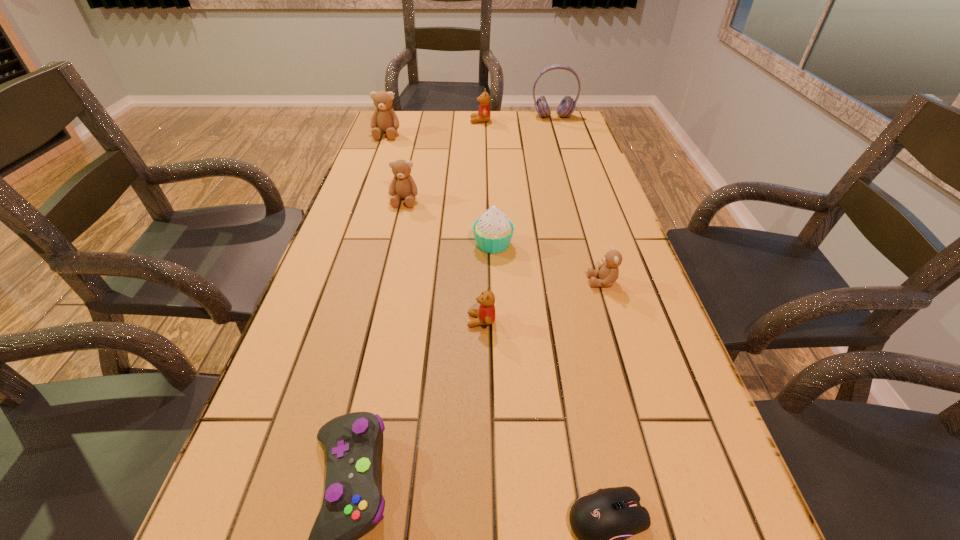
In order to click on the tallest object in this screenshot , I will do `click(567, 105)`.

Identify the location of the farthest brown teddy bear. This screenshot has width=960, height=540. (384, 119).

This screenshot has height=540, width=960. I want to click on the eighth shortest object, so click(384, 119).

Locate an element on the screen. The width and height of the screenshot is (960, 540). the farthest teddy bear is located at coordinates (483, 115).

This screenshot has width=960, height=540. I want to click on the bigger red teddy bear, so click(483, 115).

Identify the location of the second biggest brown teddy bear. This screenshot has width=960, height=540. (403, 186).

Where is `the second brown teddy bear from left to right`? This screenshot has width=960, height=540. the second brown teddy bear from left to right is located at coordinates (403, 186).

Where is `cupcake`? This screenshot has height=540, width=960. cupcake is located at coordinates (493, 231).

The height and width of the screenshot is (540, 960). Identify the location of white cupcake. [x=493, y=231].

You are a GUI agent. You are given a task and a screenshot of the screen. Output one action in this format:
    pyautogui.click(x=<x>, y=<y>)
    Task: Click on the rightmost teddy bear
    This screenshot has height=540, width=960.
    Given the screenshot: What is the action you would take?
    pyautogui.click(x=608, y=272)